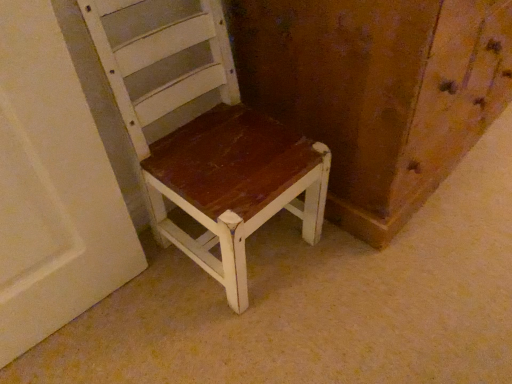
Find the location of a particular element. The width and height of the screenshot is (512, 384). free point to the right of white wood chair at center is located at coordinates (357, 272).